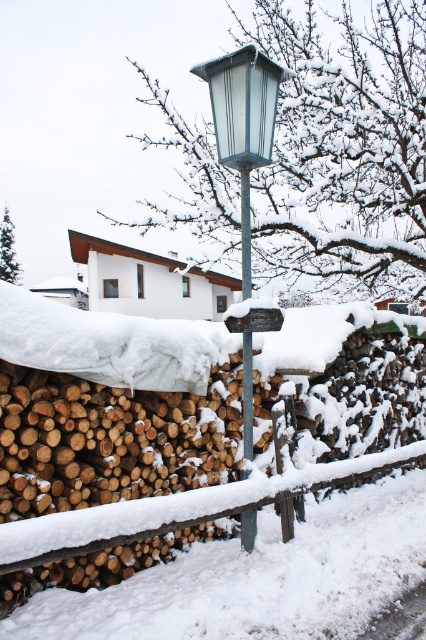
Question: Which object is positioned farthest from the white glass lamp at center?

Choices:
 (A) snow-covered wooden fence at lower center
 (B) metallic glass street light at center
 (C) metallic gray pole at center
 (D) wooden sign at center

Answer: (A)

Question: Does metallic glass street light at center have a lesser width compared to white glass lamp at center?

Choices:
 (A) yes
 (B) no

Answer: (A)

Question: In this image, where is snow-covered wooden fence at lower center located relative to metallic glass street light at center?

Choices:
 (A) above
 (B) below

Answer: (B)

Question: Among these points, which one is farthest from the camera?

Choices:
 (A) (264, 76)
 (B) (80, 577)
 (C) (239, 157)
 (D) (247, 276)

Answer: (D)

Question: Is metallic glass street light at center above white glass lamp at center?

Choices:
 (A) no
 (B) yes

Answer: (A)

Question: Estimate the real-world distances between objects in this image. Which object is closer to the wooden sign at center?

Choices:
 (A) snow-covered wooden fence at lower center
 (B) white glass lamp at center
 (C) metallic glass street light at center

Answer: (C)